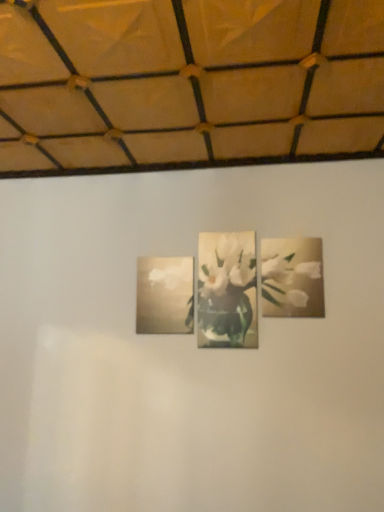
Question: Does point (x=294, y=266) appear closer or farther from the camera than point (x=147, y=326)?

Choices:
 (A) closer
 (B) farther

Answer: (A)

Question: Looking at their shapes, would you say white glossy flower at upper right is wider or thinner than matte gold picture frame at center?

Choices:
 (A) thin
 (B) wide

Answer: (A)

Question: From a real-world perspective, is white glossy flower at upper right positioned above or below matte gold picture frame at center?

Choices:
 (A) below
 (B) above

Answer: (B)

Question: From a real-world perspective, is matte gold picture frame at center positioned above or below white glossy flower at upper right?

Choices:
 (A) below
 (B) above

Answer: (A)

Question: Do you think matte gold picture frame at center is within white glossy flower at upper right, or outside of it?

Choices:
 (A) inside
 (B) outside

Answer: (B)

Question: Considering the positions of matte gold picture frame at center and white glossy flower at upper right in the image, is matte gold picture frame at center taller or shorter than white glossy flower at upper right?

Choices:
 (A) short
 (B) tall

Answer: (A)

Question: Would you say matte gold picture frame at center is to the left or to the right of white glossy flower at upper right in the picture?

Choices:
 (A) left
 (B) right

Answer: (A)